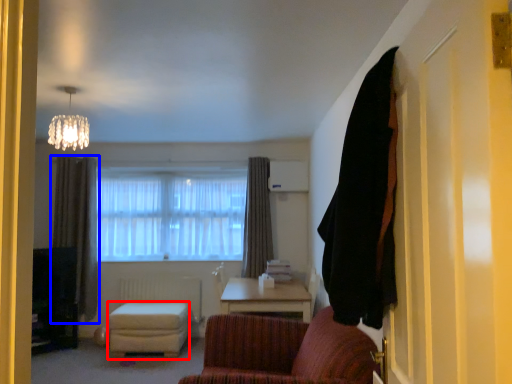
Question: Which of the following is the closest to the observer, stool (highlighted by a red box) or curtain (highlighted by a blue box)?

Choices:
 (A) stool
 (B) curtain

Answer: (A)